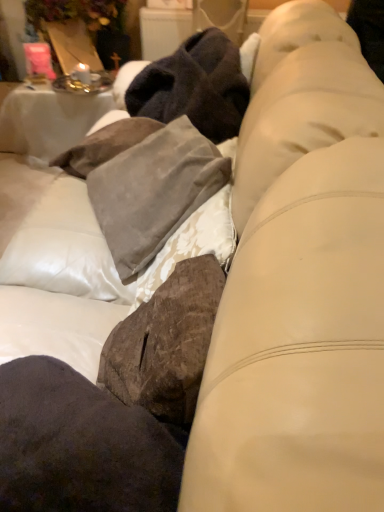
Question: Considering the positions of suede pillow at center and white clothed table at upper left in the image, is suede pillow at center taller or shorter than white clothed table at upper left?

Choices:
 (A) tall
 (B) short

Answer: (B)

Question: Based on their sizes in the image, would you say suede pillow at center is bigger or smaller than white clothed table at upper left?

Choices:
 (A) big
 (B) small

Answer: (B)

Question: Estimate the real-world distances between objects in this image. Which object is farther from the white clothed table at upper left?

Choices:
 (A) dark brown suede pillow at lower left
 (B) suede pillow at center

Answer: (A)

Question: Considering the real-world distances, which object is closest to the suede pillow at center?

Choices:
 (A) dark brown suede pillow at lower left
 (B) white clothed table at upper left

Answer: (A)